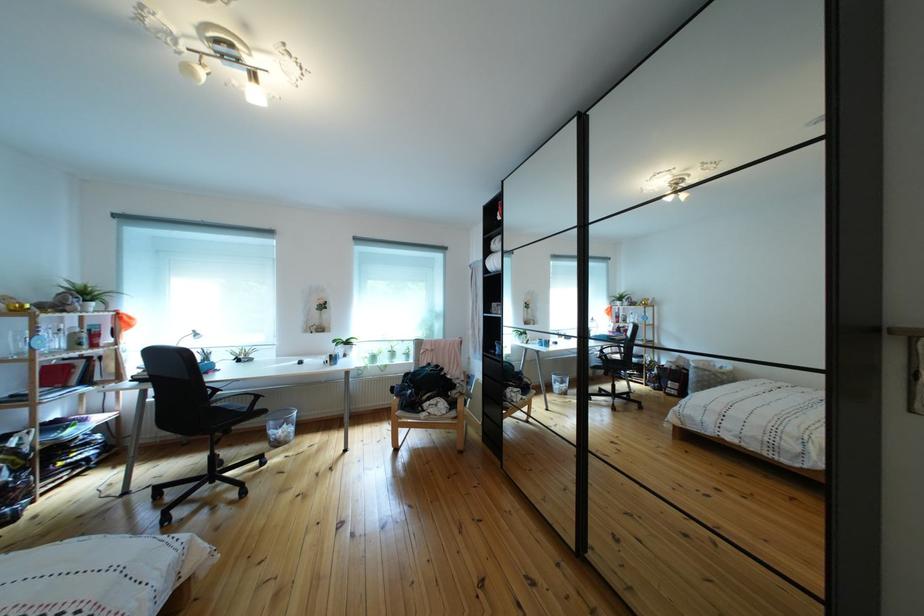
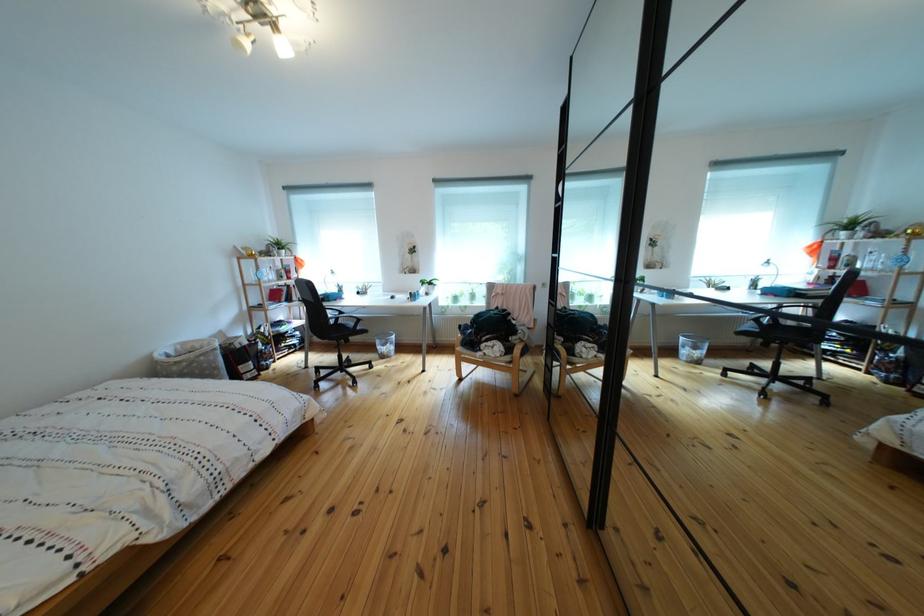
Locate, in the second image, the point that corresponds to (x=527, y=376) in the first image.

(613, 329)